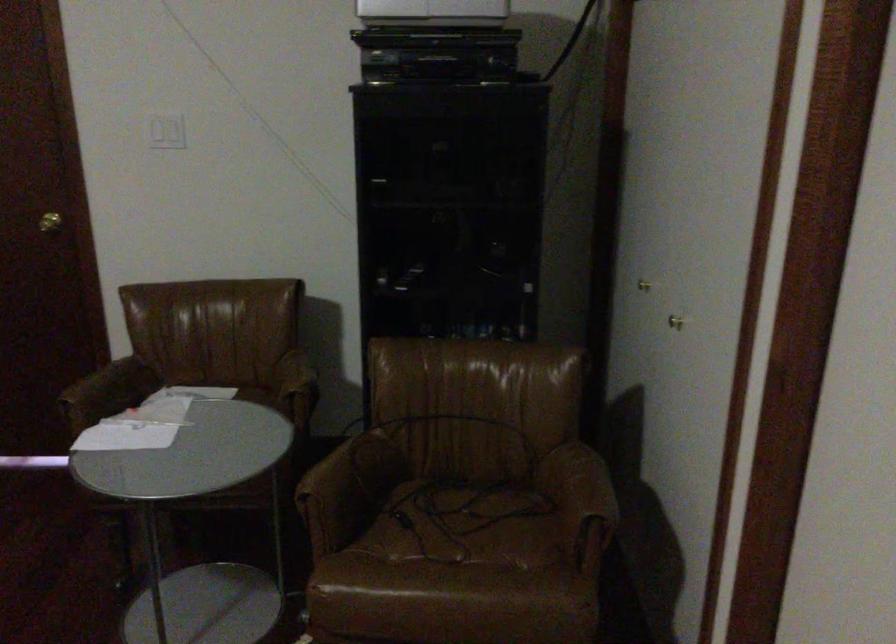
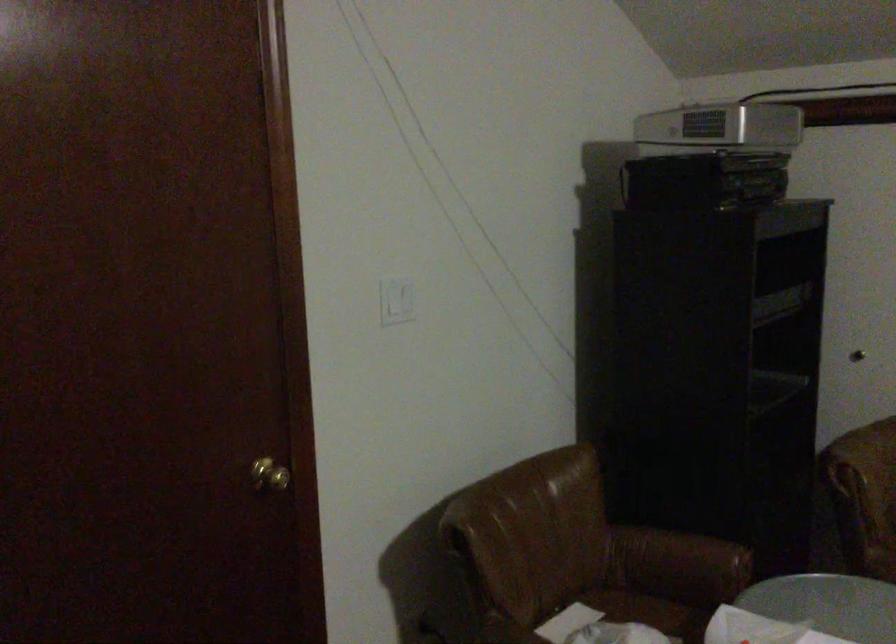
Locate, in the second image, the point that corresponds to (173,124) in the first image.

(397, 301)